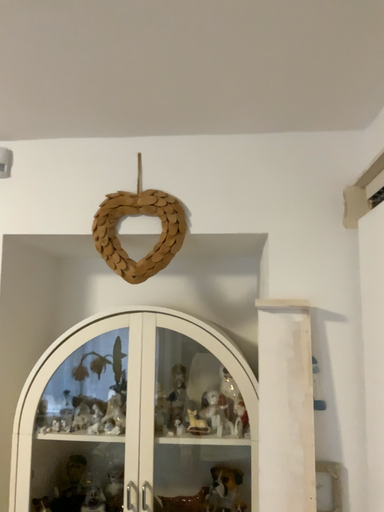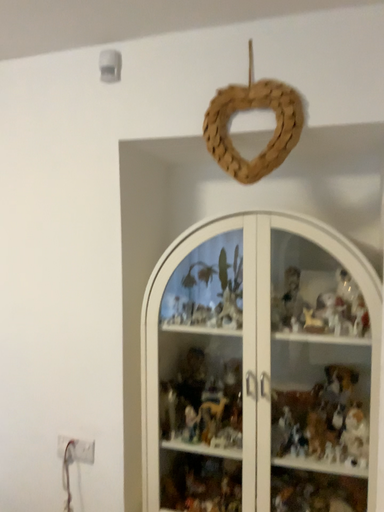
Question: Which way did the camera rotate in the video?

Choices:
 (A) rotated left
 (B) rotated right

Answer: (A)